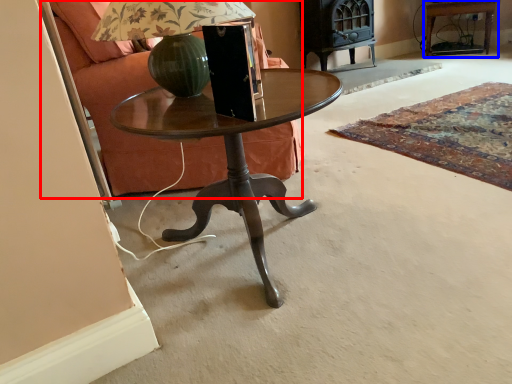
Question: Among these objects, which one is farthest to the camera, armchair (highlighted by a red box) or side table (highlighted by a blue box)?

Choices:
 (A) armchair
 (B) side table

Answer: (B)